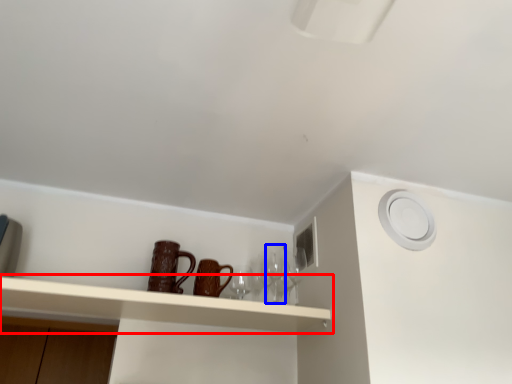
Question: Which object appears farthest to the camera in this image, shelf (highlighted by a red box) or wine glass (highlighted by a blue box)?

Choices:
 (A) shelf
 (B) wine glass

Answer: (B)